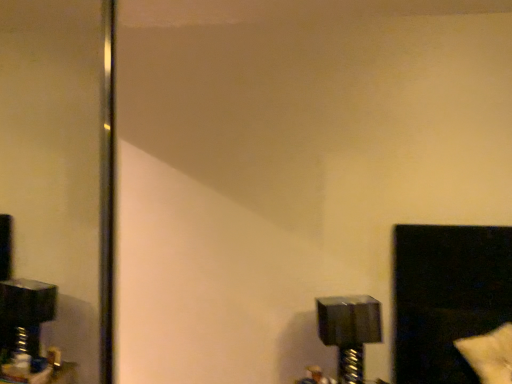
Question: From the image's perspective, is metallic silver bolt at lower right located beneath black plastic mirror at left?

Choices:
 (A) no
 (B) yes

Answer: (B)

Question: Does metallic silver bolt at lower right have a lesser width compared to black plastic mirror at left?

Choices:
 (A) yes
 (B) no

Answer: (B)

Question: Is metallic silver bolt at lower right bigger than black plastic mirror at left?

Choices:
 (A) yes
 (B) no

Answer: (B)

Question: From a real-world perspective, is metallic silver bolt at lower right located beneath black plastic mirror at left?

Choices:
 (A) yes
 (B) no

Answer: (A)

Question: Is metallic silver bolt at lower right outside of black plastic mirror at left?

Choices:
 (A) no
 (B) yes

Answer: (B)

Question: Can you confirm if metallic silver bolt at lower right is smaller than black plastic mirror at left?

Choices:
 (A) yes
 (B) no

Answer: (A)

Question: Is black glossy window at lower right further to the viewer compared to white fluffy pillow at lower right?

Choices:
 (A) yes
 (B) no

Answer: (A)

Question: Is black glossy window at lower right at the left side of white fluffy pillow at lower right?

Choices:
 (A) yes
 (B) no

Answer: (A)

Question: Considering the relative sizes of black glossy window at lower right and white fluffy pillow at lower right in the image provided, is black glossy window at lower right smaller than white fluffy pillow at lower right?

Choices:
 (A) no
 (B) yes

Answer: (A)

Question: Is black glossy window at lower right closer to camera compared to white fluffy pillow at lower right?

Choices:
 (A) no
 (B) yes

Answer: (A)

Question: Considering the relative positions of black glossy window at lower right and white fluffy pillow at lower right in the image provided, is black glossy window at lower right to the right of white fluffy pillow at lower right from the viewer's perspective?

Choices:
 (A) yes
 (B) no

Answer: (B)

Question: Is black glossy window at lower right thinner than white fluffy pillow at lower right?

Choices:
 (A) no
 (B) yes

Answer: (A)

Question: From the image's perspective, is white fluffy pillow at lower right below black glossy window at lower right?

Choices:
 (A) no
 (B) yes

Answer: (B)